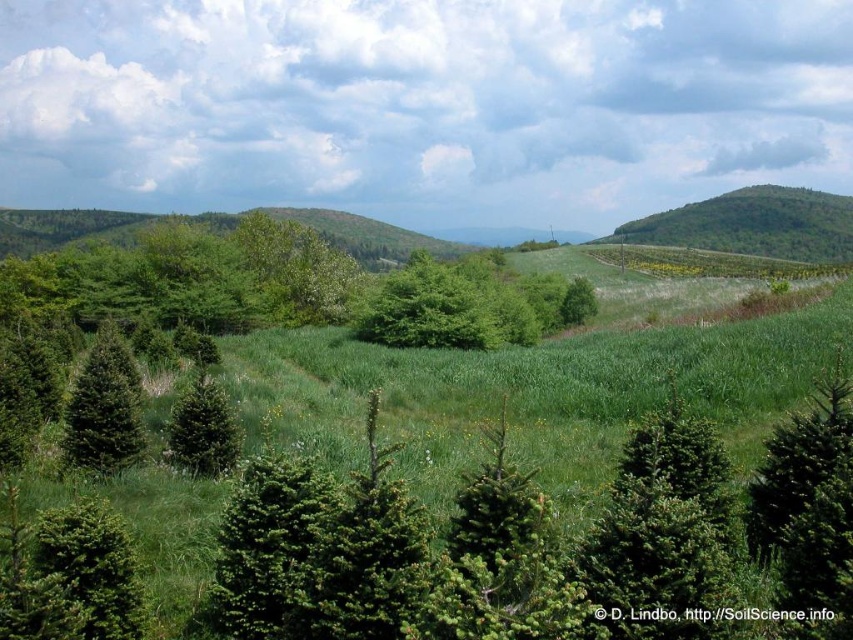
Question: Which object is positioned farthest from the green matte evergreen tree at left?

Choices:
 (A) green leafy hill at upper right
 (B) green leafy tree at center

Answer: (A)

Question: Which of the following is the closest to the observer?

Choices:
 (A) (685, 230)
 (B) (437, 339)

Answer: (B)

Question: Which of the following is the farthest from the observer?

Choices:
 (A) (100, 408)
 (B) (694, 230)

Answer: (B)

Question: Can you confirm if green leafy tree at center is positioned to the right of green leafy hill at upper right?

Choices:
 (A) no
 (B) yes

Answer: (A)

Question: Does green leafy hill at upper right have a lesser width compared to green matte evergreen tree at left?

Choices:
 (A) yes
 (B) no

Answer: (B)

Question: Does green leafy tree at center appear on the right side of green matte evergreen tree at left?

Choices:
 (A) yes
 (B) no

Answer: (A)